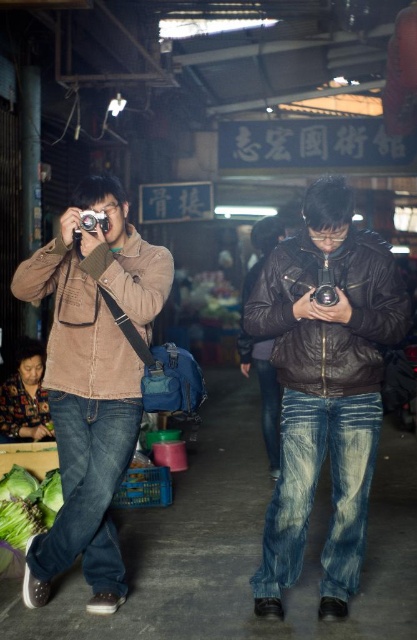
You are standing in the market and want to take a photo of the matte brown jacket at left. Where should you position yourself to capture it in your camera frame?

The matte brown jacket at left is located at point 0.600 on the x axis and 0.221 on the y axis, so you should position yourself facing that coordinate to capture it in your camera frame.